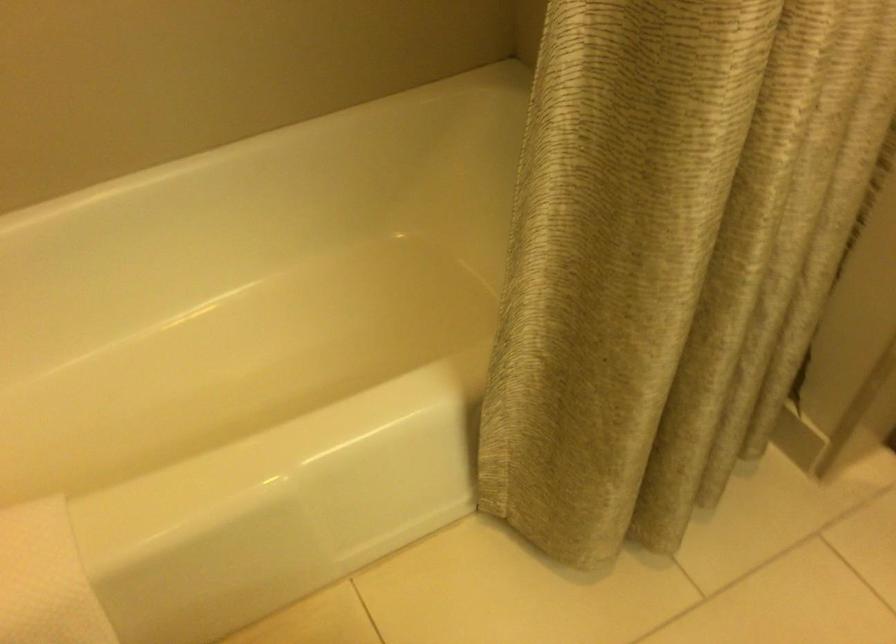
Find where to lift the white bath mat. Please return your answer as a coordinate pair (x, y).

(46, 579)